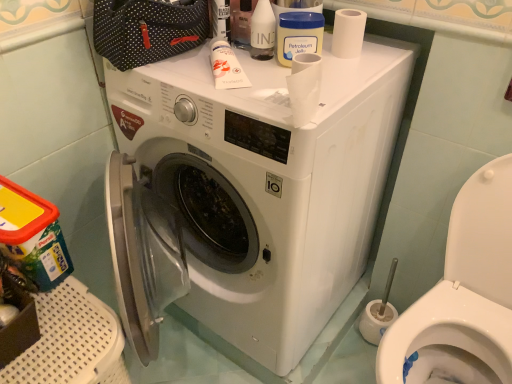
Locate an element on the screen. Image resolution: width=512 pixels, height=384 pixels. free space to the right of translucent plastic bottle at upper center, which ranks as the first toiletry in right-to-left order is located at coordinates (355, 69).